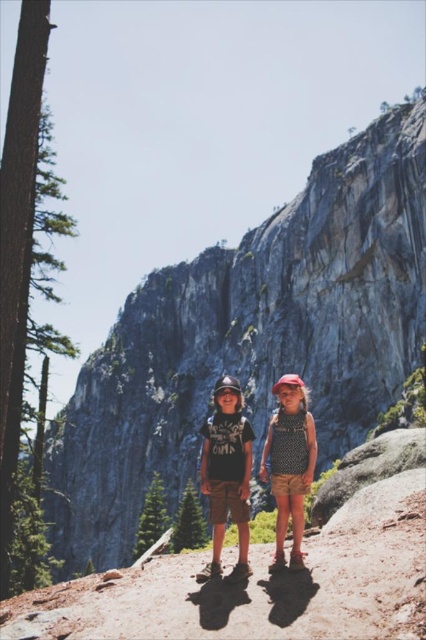
You are a photographer planning to take a landscape photo of the scene described. The gray rock formation at center is your main subject. To ensure it stays centered in your shot, where should you position your camera relative to the scene?

The gray rock formation at center is located at point (250, 339), so you should position your camera directly facing that coordinate to keep it centered in your photo.

You are a photographer standing in front of the rocky outcrop. You want to take a photo that includes both the matte black shorts at center and the green textured pine at center. Which object should you focus on first to ensure both are in sharp focus?

You should focus on the matte black shorts at center first because it is closer to the viewer than the green textured pine at center, so by focusing on the closer object, the pine in the background will still be in focus due to the depth of field.

Based on the photo, you are a hiker planning to place a safety marker at the point marked by point (227, 472). According to the scene description, what object is located at that point?

The point (227, 472) corresponds to the matte black helmet at center.